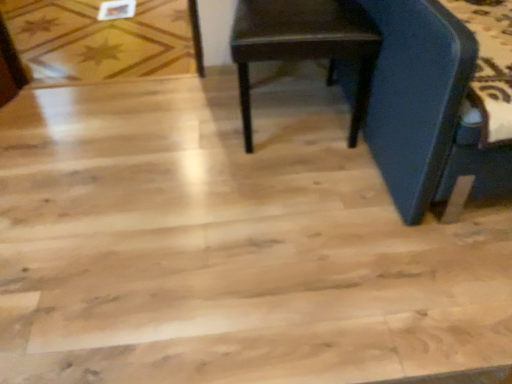
This screenshot has height=384, width=512. What are the coordinates of `free space in front of dark brown wood chair at center` in the screenshot? It's located at (284, 194).